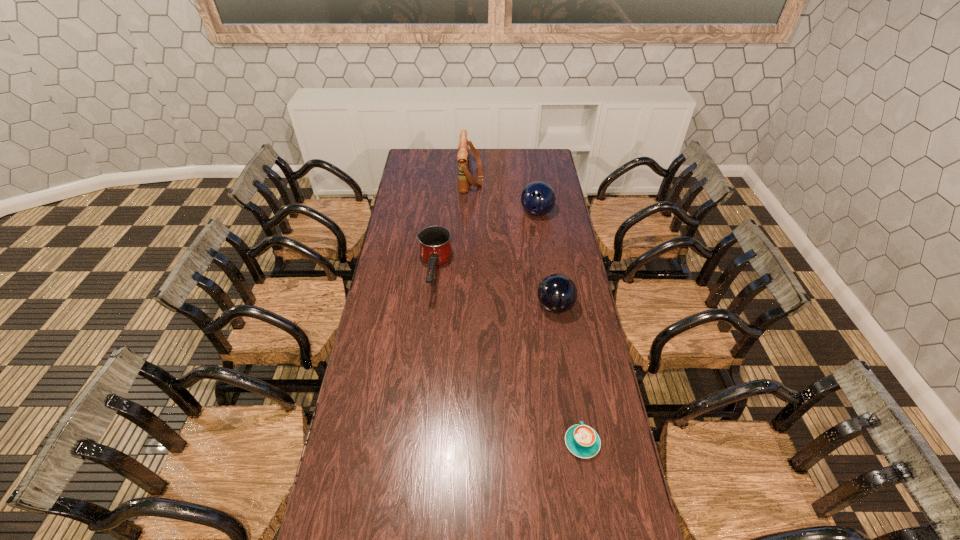
Find the location of a particular element. Image resolution: width=960 pixels, height=540 pixels. free space located on the side of the nearer bowling ball with the finger holes is located at coordinates (486, 306).

You are a GUI agent. You are given a task and a screenshot of the screen. Output one action in this format:
    pyautogui.click(x=<x>, y=<y>)
    Task: Click on the free space located on the side of the nearer bowling ball with the finger holes
    The width and height of the screenshot is (960, 540).
    Given the screenshot: What is the action you would take?
    pyautogui.click(x=478, y=306)

Find the location of a particular element. The height and width of the screenshot is (540, 960). vacant space located on the handle side of the saucepan is located at coordinates (427, 345).

Identify the location of vacant space located 0.350m with the handle on the right side of the nearest object. (564, 341).

Locate an element on the screen. This screenshot has height=540, width=960. free region located 0.190m with the handle on the right side of the nearest object is located at coordinates (571, 377).

Locate an element on the screen. vacant region located with the handle on the right side of the nearest object is located at coordinates (576, 404).

Image resolution: width=960 pixels, height=540 pixels. Find the location of `object located at the far edge`. object located at the far edge is located at coordinates (464, 177).

This screenshot has height=540, width=960. I want to click on cappuccino present at the right edge, so click(x=583, y=441).

In the image, there is a desktop. Find the location of `vacant space at the left edge`. vacant space at the left edge is located at coordinates (378, 308).

What are the coordinates of `vacant region at the right edge` in the screenshot? It's located at (631, 522).